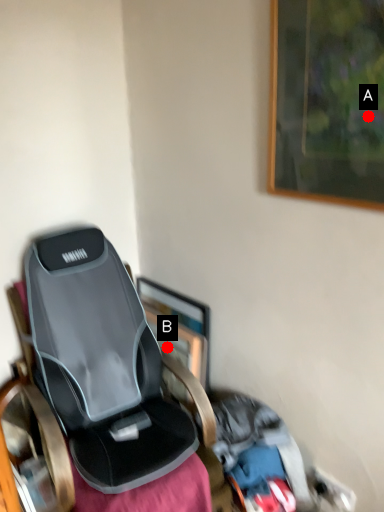
Question: Two points are circled on the image, labeled by A and B beside each circle. Which point appears closest to the camera in this image?

Choices:
 (A) A is closer
 (B) B is closer

Answer: (A)